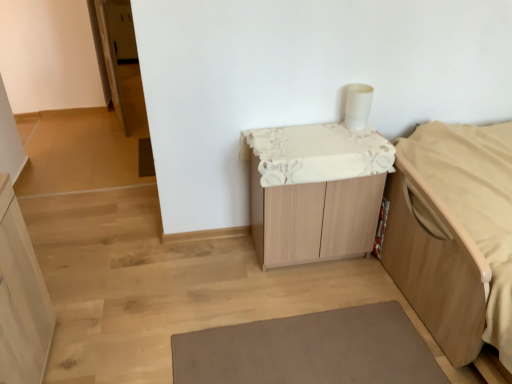
Locate an element on the screen. The width and height of the screenshot is (512, 384). free space between gray matte bath mat at lower center and wooden cabinet at center is located at coordinates (283, 281).